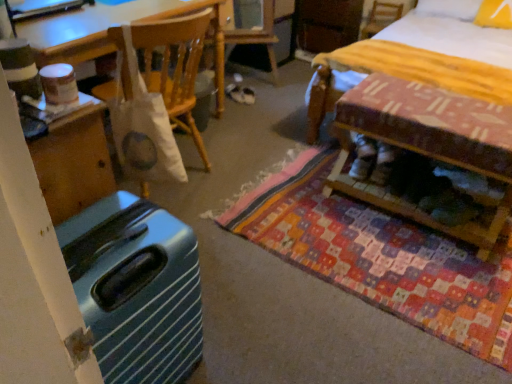
I want to click on vacant location below patchwork fabric mat at center (from a real-world perspective), so click(x=394, y=256).